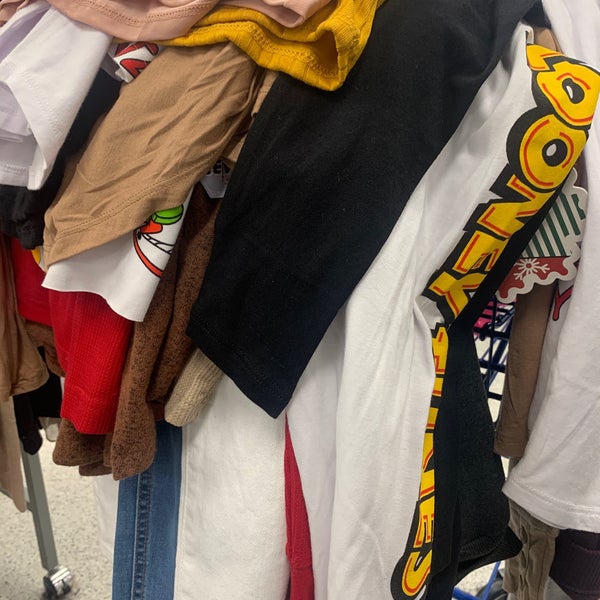
Where is `carpet`? Image resolution: width=600 pixels, height=600 pixels. carpet is located at coordinates tap(74, 523), tap(14, 561).